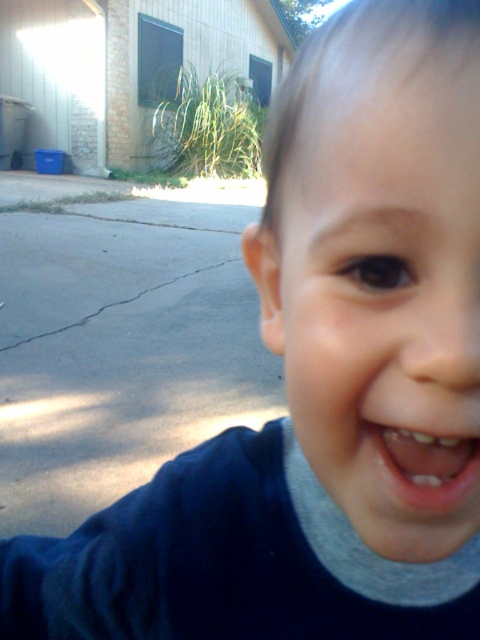
You are a photographer trying to capture a closeup of the smooth skin face at center. The camera you are using has a minimum focusing distance of 10 inches. Can you take the photo without moving the camera closer?

The smooth skin face at center and camera are 8.09 inches apart from each other, which is less than the minimum focusing distance of 10 inches. Therefore, you cannot take the photo without moving the camera further away.